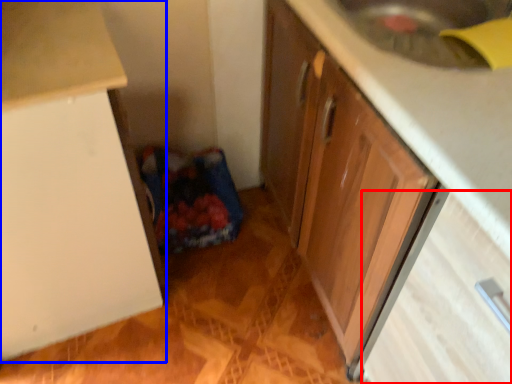
Question: Which object appears closest to the camera in this image, drawer (highlighted by a red box) or cabinetry (highlighted by a blue box)?

Choices:
 (A) drawer
 (B) cabinetry

Answer: (A)